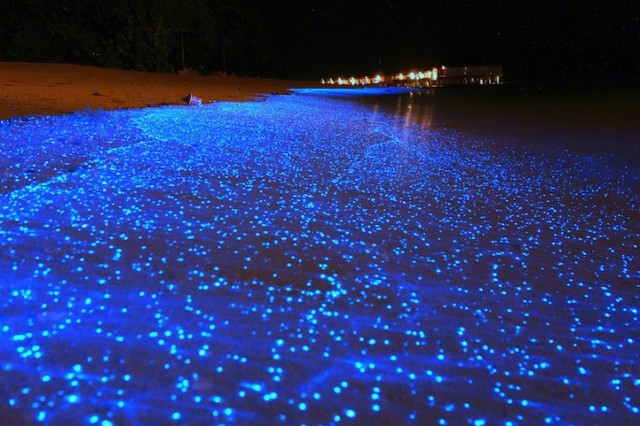
Where is `bucket`? The image size is (640, 426). bucket is located at coordinates (189, 97).